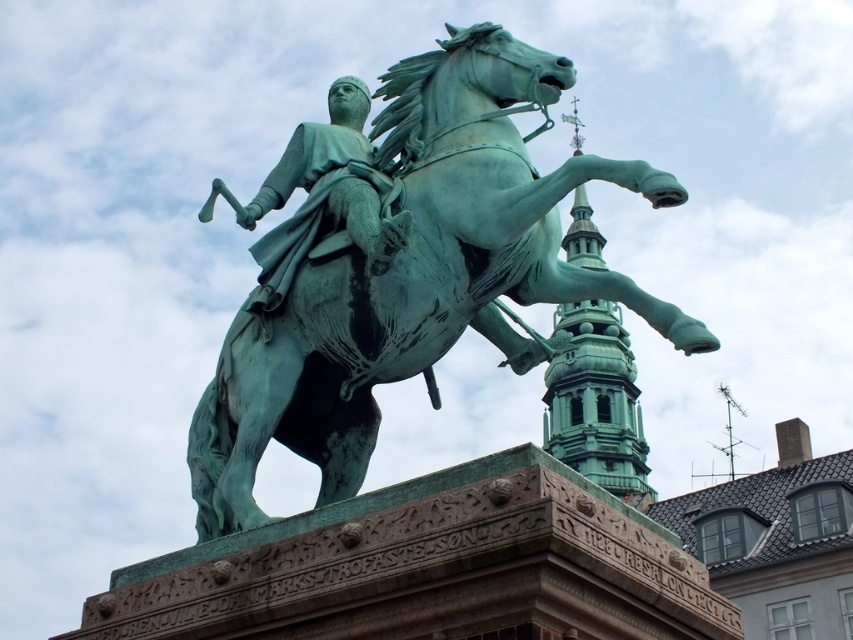
You are a city planner reviewing a public square design. The square has a green patinated bronze statue at center and a green patina tower at upper center. According to the design, which object is placed above the other?

The green patinated bronze statue at center is positioned over the green patina tower at upper center.

Based on the photo, you are an architect designing a new plaza and want to place a bench between the green patina horse at center and the green patina tower at upper center. The bench requires a minimum of 10 meters of space between them to be placed safely. Can the bench be placed between them?

The green patina horse at center and green patina tower at upper center are 12.03 meters apart, which is more than the required 10 meters, so the bench can be placed between them safely.

Looking at this image, you are standing in front of the equestrian statue and want to touch the green patina horse at center and the green patinated bronze statue at center. Which one would you reach first?

The green patina horse at center is closer to the viewer than the green patinated bronze statue at center, so you would reach the green patina horse at center first.